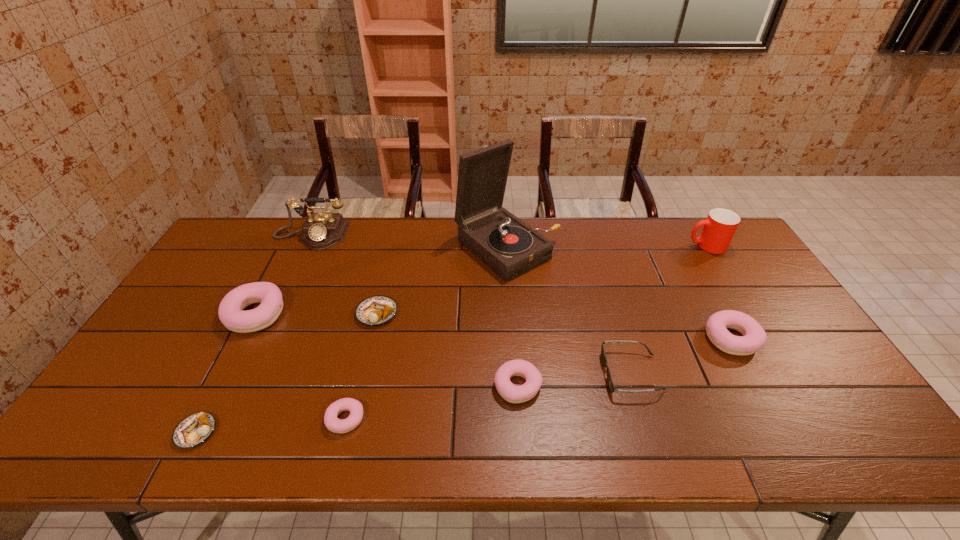
I want to click on vacant area that lies between the smallest pink pastry and the biggest pink pastry, so click(300, 367).

Identify the location of free space between the fourth tallest object and the smallest pink pastry. The image size is (960, 540). (300, 367).

You are a GUI agent. You are given a task and a screenshot of the screen. Output one action in this format:
    pyautogui.click(x=<x>, y=<y>)
    Task: Click on the unoccupied area between the right brown pastry and the black telephone
    
    Given the screenshot: What is the action you would take?
    pyautogui.click(x=344, y=275)

You are a GUI agent. You are given a task and a screenshot of the screen. Output one action in this format:
    pyautogui.click(x=<x>, y=<y>)
    Task: Click on the unoccupied position between the left brown pastry and the telephone
    
    Given the screenshot: What is the action you would take?
    pyautogui.click(x=253, y=334)

At what (x,y) coordinates should I click in order to perform the action: click on the third closest object to the phonograph record. Please return your answer as a coordinate pair (x, y). The width and height of the screenshot is (960, 540). Looking at the image, I should click on (512, 393).

What are the coordinates of `the third closest object to the phonograph record` in the screenshot? It's located at (512, 393).

Locate which pastry is the fifth closest to the second pastry from right to left. Please provide its 2D coordinates. Your answer should be formatted as a tuple, i.e. [(x, y)], where the tuple contains the x and y coordinates of a point satisfying the conditions above.

[(193, 430)]

Choose which pastry is the third nearest neighbor to the second smallest pink pastry. Please provide its 2D coordinates. Your answer should be formatted as a tuple, i.e. [(x, y)], where the tuple contains the x and y coordinates of a point satisfying the conditions above.

[(754, 337)]

At what (x,y) coordinates should I click in order to perform the action: click on pink pastry that is the nearest to the smallest pink pastry. Please return your answer as a coordinate pair (x, y). This screenshot has width=960, height=540. Looking at the image, I should click on pos(230,312).

This screenshot has height=540, width=960. I want to click on pink pastry that stands as the closest to the smallest pink pastry, so click(x=230, y=312).